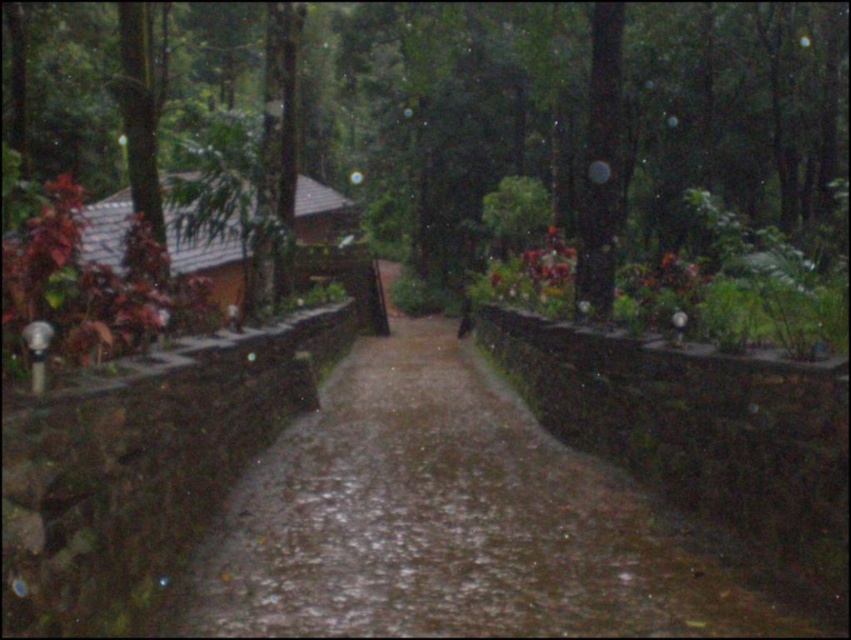
You are a GUI agent. You are given a task and a screenshot of the screen. Output one action in this format:
    pyautogui.click(x=<x>, y=<y>)
    Task: Click on the green leafy forest at center
    The image size is (851, 640).
    Given the screenshot: What is the action you would take?
    pyautogui.click(x=446, y=113)

Which is above, green leafy forest at center or green matte tree at center?

green leafy forest at center is higher up.

In the scene shown: Measure the distance between green leafy forest at center and camera.

5.60 meters

This screenshot has width=851, height=640. Find the location of `green leafy forest at center`. green leafy forest at center is located at coordinates (446, 113).

Who is positioned more to the left, damp concrete path at center or green matte tree at center?

damp concrete path at center is more to the left.

Does damp concrete path at center have a greater height compared to green matte tree at center?

In fact, damp concrete path at center may be shorter than green matte tree at center.

Describe the element at coordinates (458, 522) in the screenshot. I see `damp concrete path at center` at that location.

Locate an element on the screen. This screenshot has width=851, height=640. damp concrete path at center is located at coordinates (458, 522).

The width and height of the screenshot is (851, 640). Describe the element at coordinates (446, 113) in the screenshot. I see `green leafy forest at center` at that location.

Between green leafy forest at center and damp concrete path at center, which one appears on the right side from the viewer's perspective?

damp concrete path at center

Does point (461, 186) come closer to viewer compared to point (300, 465)?

No, it is behind (300, 465).

Locate an element on the screen. The height and width of the screenshot is (640, 851). green leafy forest at center is located at coordinates (446, 113).